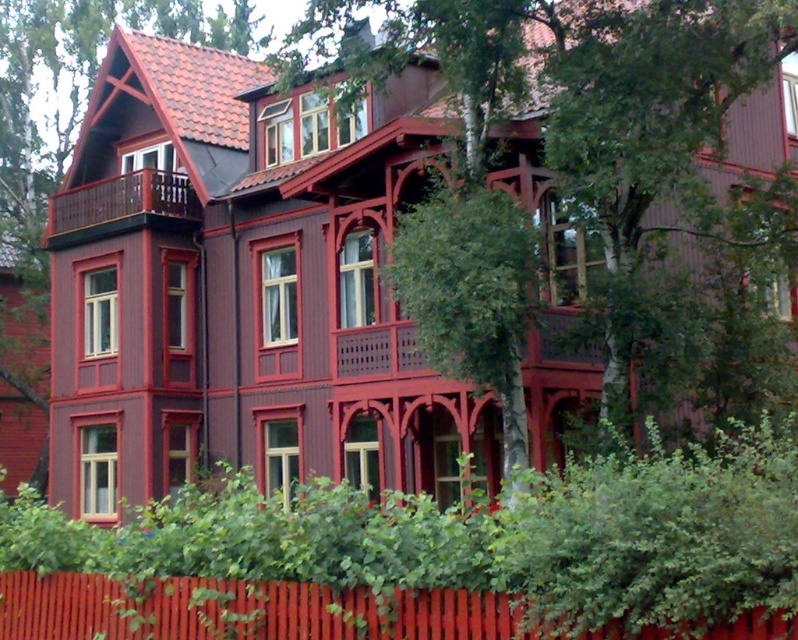
You are a painter standing in front of the house. You want to paint the green leafy tree at center and the brown wooden balcony at left. Which object should you focus on first if you want to paint the narrower one first?

The green leafy tree at center is thinner than the brown wooden balcony at left, so you should focus on painting the green leafy tree at center first.

You are standing in front of the house and want to know the position of the green leafy tree at center. What are its coordinates?

The green leafy tree at center is located at point (x=471, y=289).